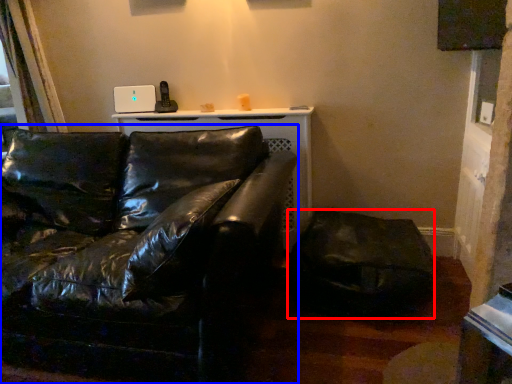
Question: Among these objects, which one is farthest to the camera, swivel chair (highlighted by a red box) or studio couch (highlighted by a blue box)?

Choices:
 (A) swivel chair
 (B) studio couch

Answer: (A)